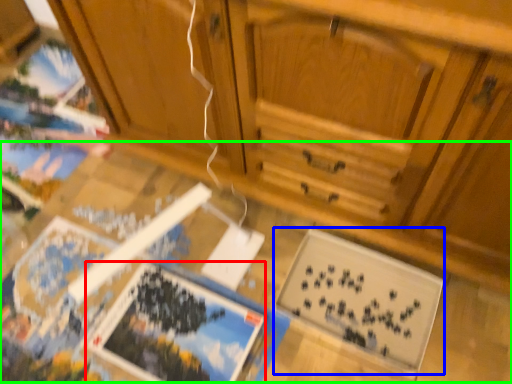
Question: Considering the real-world distances, which object is farthest from magazine (highlighted by a red box)? magazine (highlighted by a blue box) or table (highlighted by a green box)?

Choices:
 (A) magazine
 (B) table

Answer: (A)